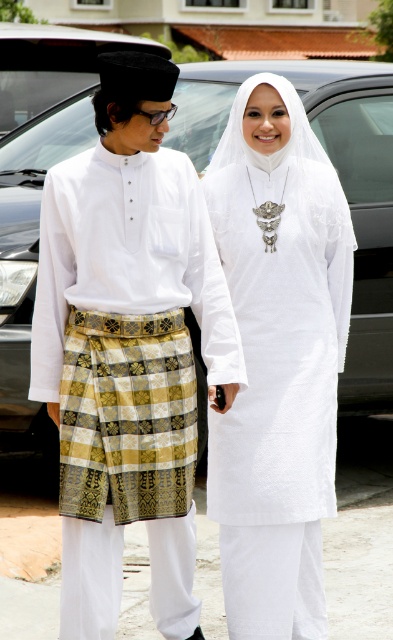
You are taking a photo of two people standing in front of a parked car. You notice two points marked on the image at coordinates point (268,362) and point (374,376). Which point is closer to the camera?

Point (268,362) is closer to the camera than point (374,376).

Based on the photo, you are a photographer trying to capture the two subjects in the scene. The white woven kain at left and the metallic gray car at center are both in your frame. Which object is narrower in width?

The white woven kain at left is thinner than the metallic gray car at center, so the white woven kain at left is narrower in width.

You are a photographer who needs to adjust the lighting to ensure both the white woven kain at left and the white matte dress at center are visible. Which object is positioned lower and requires more downward lighting?

The white woven kain at left is below the white matte dress at center, so it requires more downward lighting to ensure visibility.